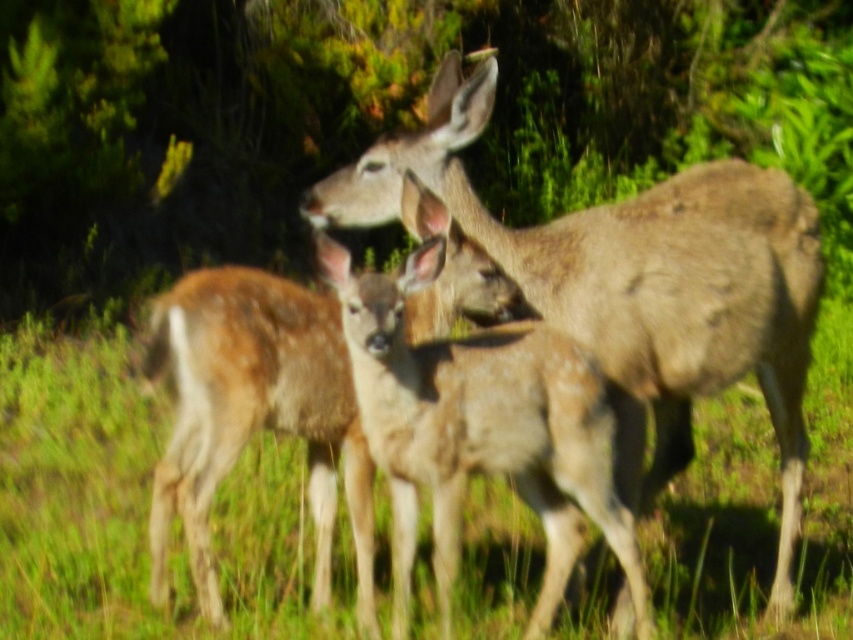
You are a photographer positioned in the grassy field with the three deer. You want to take a photo that includes both the point at coordinates point (546, 305) and point (463, 432). Which point should you focus on first to ensure both are in focus?

You should focus on point (463, 432) first because it is closer to you than point (546, 305), which is further away. This way, the depth of field will include both points.

You are a wildlife photographer aiming to capture a photo of the brown fur deer at center and the spotted fur deer at center. Based on their positions, which deer would appear closer to the camera in the photo?

The brown fur deer at center appears closer to the camera because it is positioned above the spotted fur deer at center, which is a common visual cue for depth where objects higher in the frame can seem nearer when overlapping.